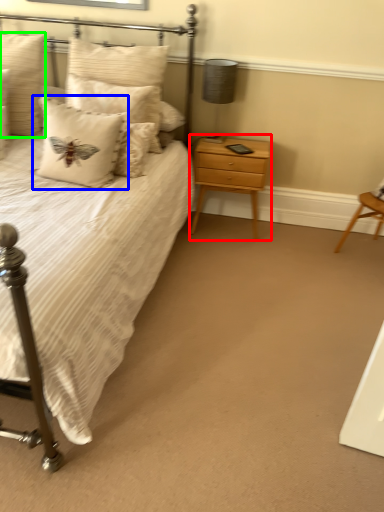
Question: Estimate the real-world distances between objects in this image. Which object is farther from nightstand (highlighted by a red box), pillow (highlighted by a blue box) or pillow (highlighted by a green box)?

Choices:
 (A) pillow
 (B) pillow

Answer: (B)